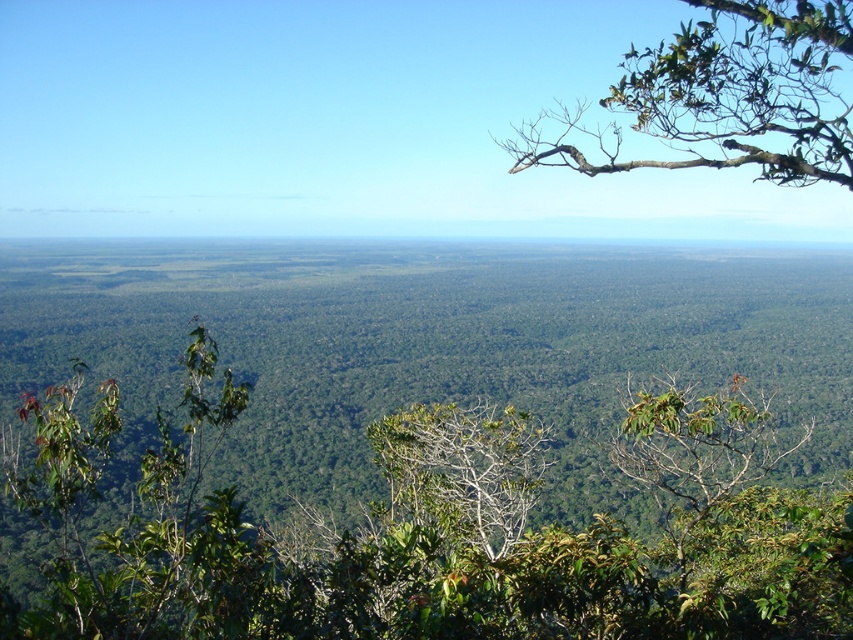
Question: Which point appears closest to the camera in this image?

Choices:
 (A) (682, 106)
 (B) (109, 616)

Answer: (B)

Question: Can you confirm if green leafy tree at center is positioned to the right of green leafy branch at upper right?

Choices:
 (A) yes
 (B) no

Answer: (B)

Question: Which point appears farthest from the camera in this image?

Choices:
 (A) (248, 579)
 (B) (735, 29)

Answer: (B)

Question: Is green leafy tree at center in front of green leafy branch at upper right?

Choices:
 (A) yes
 (B) no

Answer: (A)

Question: Is green leafy tree at center positioned at the back of green leafy branch at upper right?

Choices:
 (A) no
 (B) yes

Answer: (A)